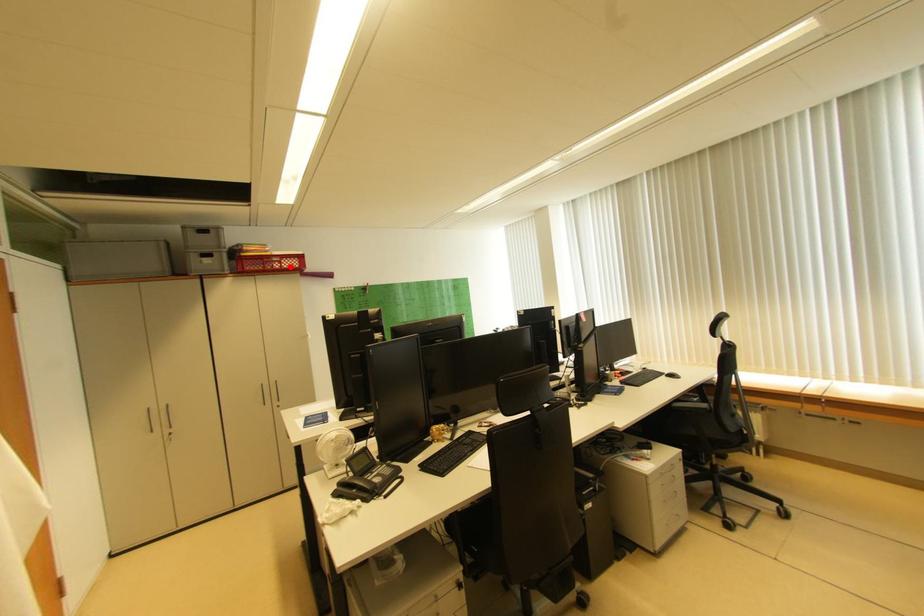
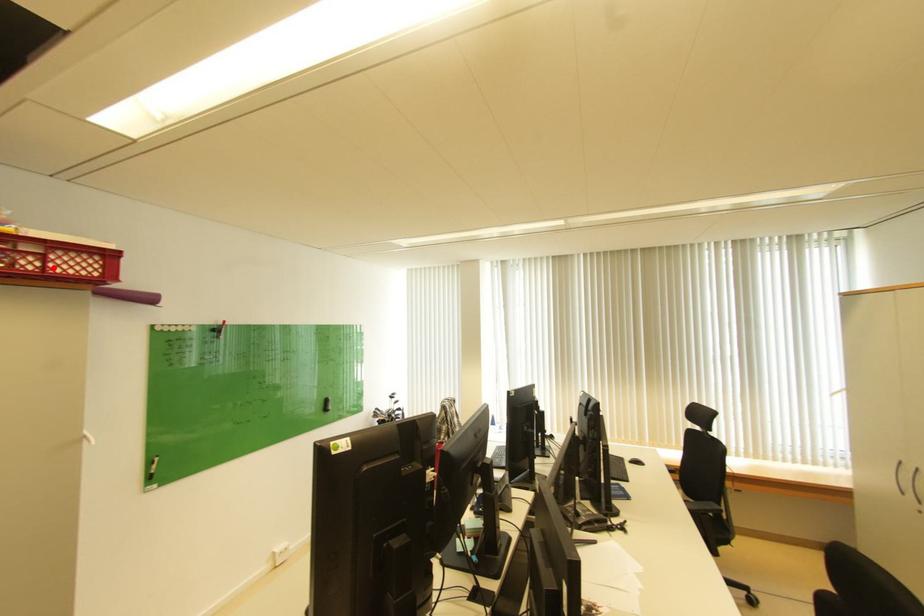
I am providing you with two images of the same scene from different viewpoints. A red point is marked on the first image and another point is marked on the second image. Are the points marked in image1 and image2 representing the same 3D position?

Yes